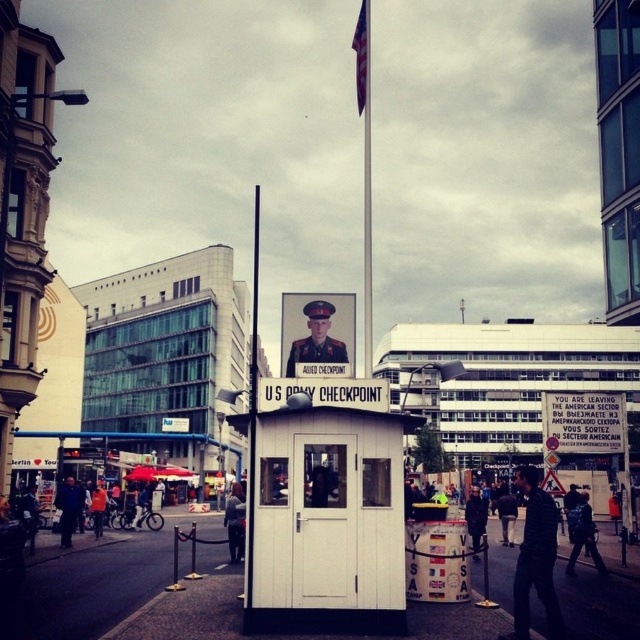
From the picture: Does dark blue shirt at center have a lesser width compared to white fabric flag at upper center?

Yes, dark blue shirt at center is thinner than white fabric flag at upper center.

How far apart are dark blue shirt at center and white fabric flag at upper center?

dark blue shirt at center is 105.78 meters from white fabric flag at upper center.

You are a GUI agent. You are given a task and a screenshot of the screen. Output one action in this format:
    pyautogui.click(x=<x>, y=<y>)
    Task: Click on the dark blue shirt at center
    This screenshot has height=640, width=640.
    Given the screenshot: What is the action you would take?
    pyautogui.click(x=536, y=560)

Based on the photo, between uniformed officer at center and white fabric flag at upper center, which one is positioned lower?

uniformed officer at center is below.

The image size is (640, 640). Describe the element at coordinates (316, 339) in the screenshot. I see `uniformed officer at center` at that location.

You are a GUI agent. You are given a task and a screenshot of the screen. Output one action in this format:
    pyautogui.click(x=<x>, y=<y>)
    Task: Click on the uniformed officer at center
    The image size is (640, 640).
    Given the screenshot: What is the action you would take?
    pyautogui.click(x=316, y=339)

Does dark blue jeans at center have a greater width compared to white fabric flag at upper center?

No, dark blue jeans at center is not wider than white fabric flag at upper center.

Does dark blue jeans at center have a lesser height compared to white fabric flag at upper center?

Indeed, dark blue jeans at center has a lesser height compared to white fabric flag at upper center.

The height and width of the screenshot is (640, 640). What do you see at coordinates (582, 536) in the screenshot?
I see `dark blue jeans at center` at bounding box center [582, 536].

This screenshot has height=640, width=640. In order to click on dark blue jeans at center in this screenshot , I will do [582, 536].